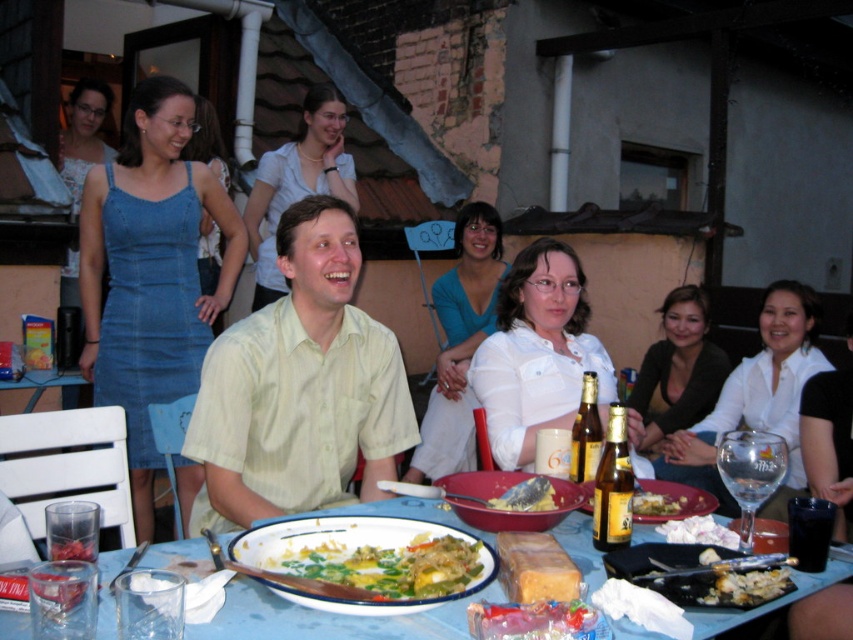
Is point (335, 97) more distant than point (479, 547)?

That is True.

Based on the photo, who is more distant from viewer, (354, 179) or (306, 592)?

The point (354, 179) is behind.

The image size is (853, 640). Identify the location of white glossy shirt at upper center. (297, 182).

Can you confirm if denim dress at left is positioned to the right of yellowish matte bread at center?

In fact, denim dress at left is to the left of yellowish matte bread at center.

Locate an element on the screen. The height and width of the screenshot is (640, 853). denim dress at left is located at coordinates pos(149,272).

Is smooth pinkish-red meat at center to the right of gold glass beer bottle at center from the viewer's perspective?

In fact, smooth pinkish-red meat at center is to the left of gold glass beer bottle at center.

Who is lower down, smooth pinkish-red meat at center or gold glass beer bottle at center?

smooth pinkish-red meat at center is lower down.

Is point (556, 612) farther from viewer compared to point (587, 372)?

No, it is not.

Locate an element on the screen. This screenshot has height=640, width=853. smooth pinkish-red meat at center is located at coordinates (531, 620).